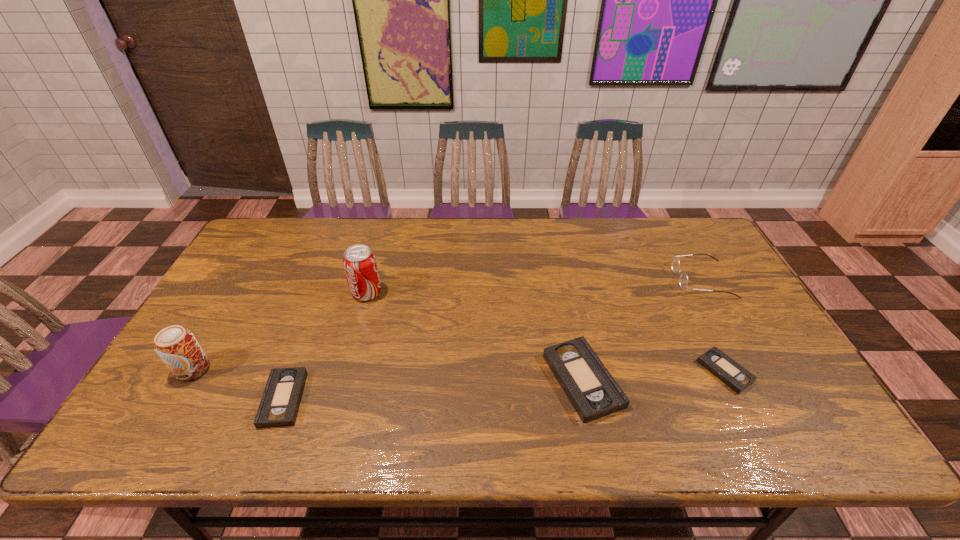
You are a GUI agent. You are given a task and a screenshot of the screen. Output one action in this format:
    pyautogui.click(x=<x>, y=<y>)
    Task: Click on the second tallest object
    The width and height of the screenshot is (960, 540).
    Given the screenshot: What is the action you would take?
    pyautogui.click(x=177, y=347)

This screenshot has width=960, height=540. I want to click on free space located 0.190m on the left of the leftmost videotape, so click(184, 399).

The image size is (960, 540). I want to click on free space located on the back of the fourth tallest object, so click(561, 274).

Identify the location of free space located on the left of the shortest object. (606, 372).

Locate an element on the screen. vacant area situated on the back of the soda is located at coordinates (386, 221).

Identify the location of vacant space positioned 0.130m through the lenses of the third tallest object. This screenshot has height=540, width=960. pos(634,279).

This screenshot has height=540, width=960. What are the coordinates of `vacant space located through the lenses of the third tallest object` in the screenshot? It's located at (595, 279).

Locate an element on the screen. vacant space located 0.310m through the lenses of the third tallest object is located at coordinates (576, 279).

Identify the location of free space located 0.170m on the right of the beer can. [x=276, y=369].

You are a GUI agent. You are given a task and a screenshot of the screen. Output one action in this format:
    pyautogui.click(x=<x>, y=<y>)
    Task: Click on the beer can that is positioned at the near edge
    
    Given the screenshot: What is the action you would take?
    pyautogui.click(x=177, y=347)